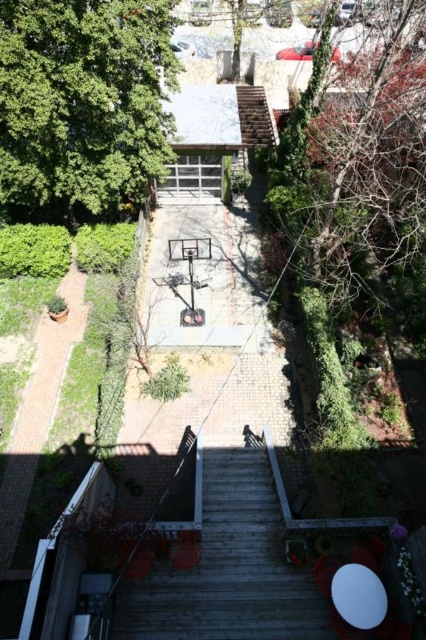
Question: Considering the relative positions of green leafy tree at upper left and wooden stairs at center in the image provided, where is green leafy tree at upper left located with respect to wooden stairs at center?

Choices:
 (A) below
 (B) above

Answer: (B)

Question: Which object is closer to the camera taking this photo?

Choices:
 (A) wooden stairs at center
 (B) bare branches at upper right

Answer: (A)

Question: Is green leafy tree at upper left thinner than bare branches at upper right?

Choices:
 (A) no
 (B) yes

Answer: (A)

Question: Which point is closer to the camera?

Choices:
 (A) (178, 600)
 (B) (330, 244)

Answer: (A)

Question: Which of the following is the farthest from the observer?

Choices:
 (A) (382, 74)
 (B) (233, 573)
 (C) (88, 179)

Answer: (C)

Question: Is green leafy tree at upper left to the right of wooden stairs at center from the viewer's perspective?

Choices:
 (A) no
 (B) yes

Answer: (A)